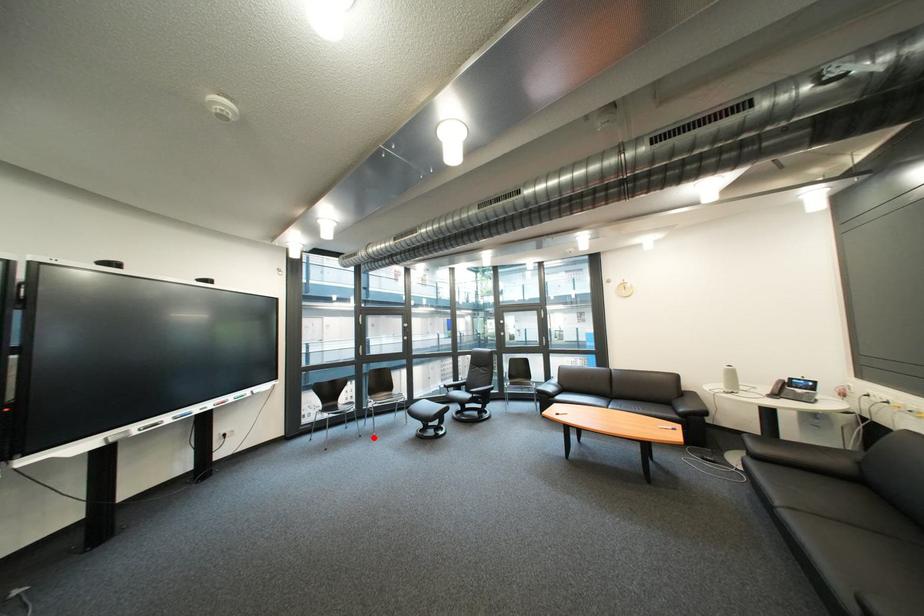
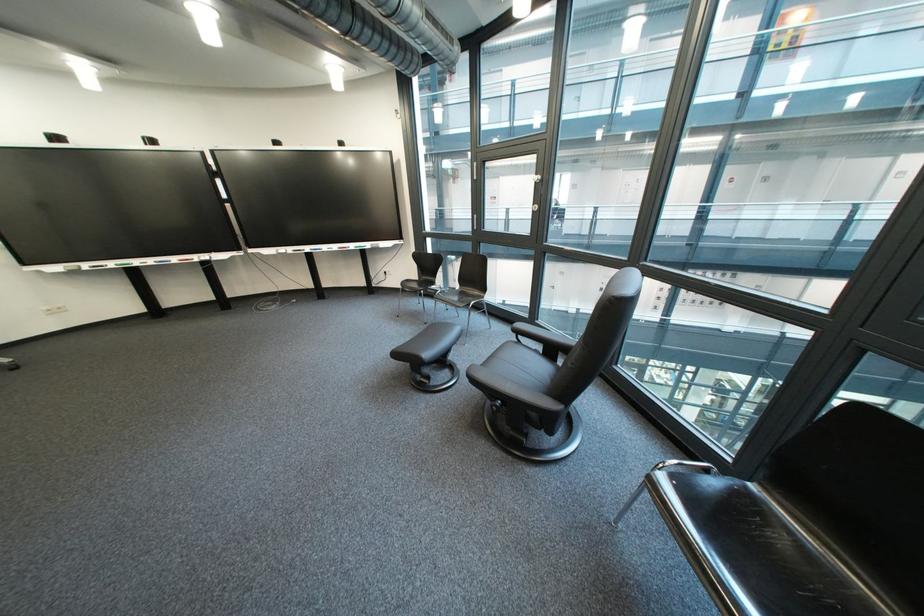
Locate, in the second image, the point that corresponds to the highlighted location in the first image.

(439, 325)